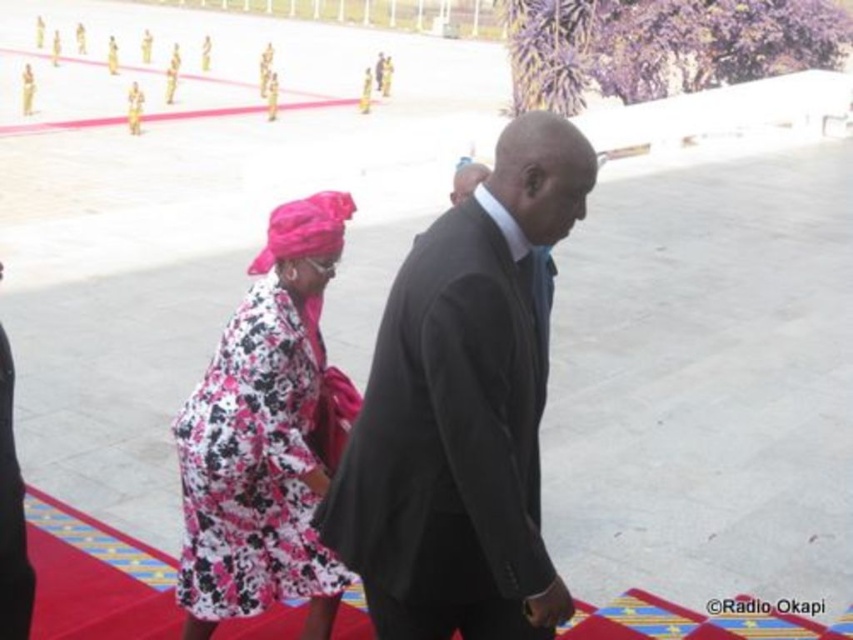
Question: Is dark gray suit at center above floral fabric dress at center?

Choices:
 (A) no
 (B) yes

Answer: (B)

Question: Which of the following is the closest to the observer?

Choices:
 (A) dark gray suit at center
 (B) floral fabric dress at center

Answer: (A)

Question: Can you confirm if dark gray suit at center is positioned to the right of floral fabric dress at center?

Choices:
 (A) yes
 (B) no

Answer: (A)

Question: Which point is farther to the camera?

Choices:
 (A) dark gray suit at center
 (B) floral fabric dress at center

Answer: (B)

Question: Which point is farther to the camera?

Choices:
 (A) dark gray suit at center
 (B) floral fabric dress at center

Answer: (B)

Question: Does dark gray suit at center lie in front of floral fabric dress at center?

Choices:
 (A) no
 (B) yes

Answer: (B)